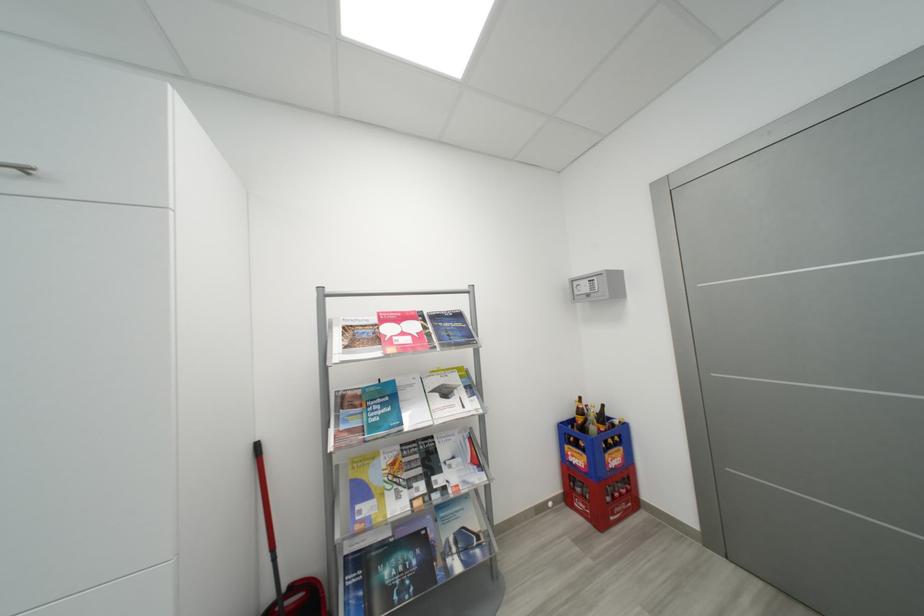
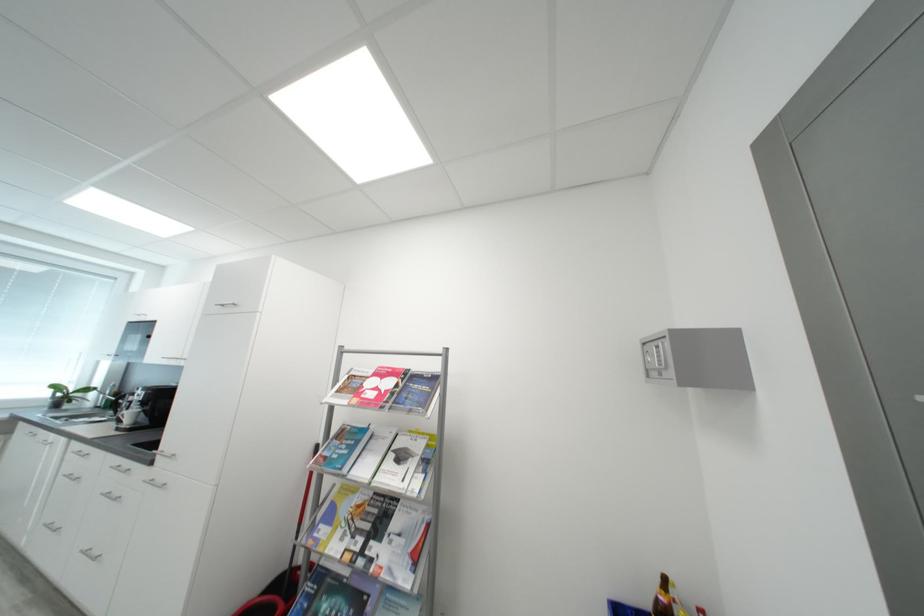
Locate, in the second image, the point that corresponds to (x=599, y=290) in the first image.

(666, 362)